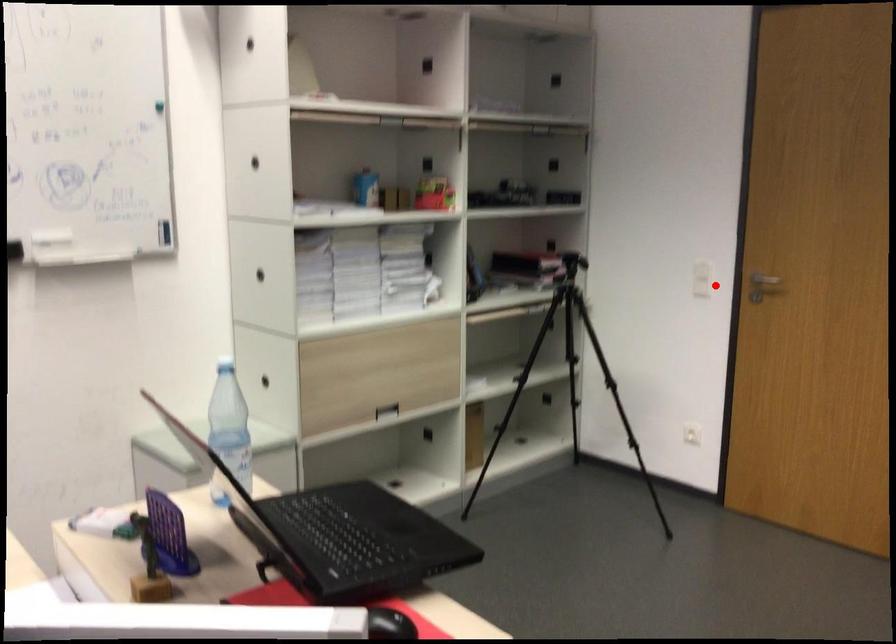
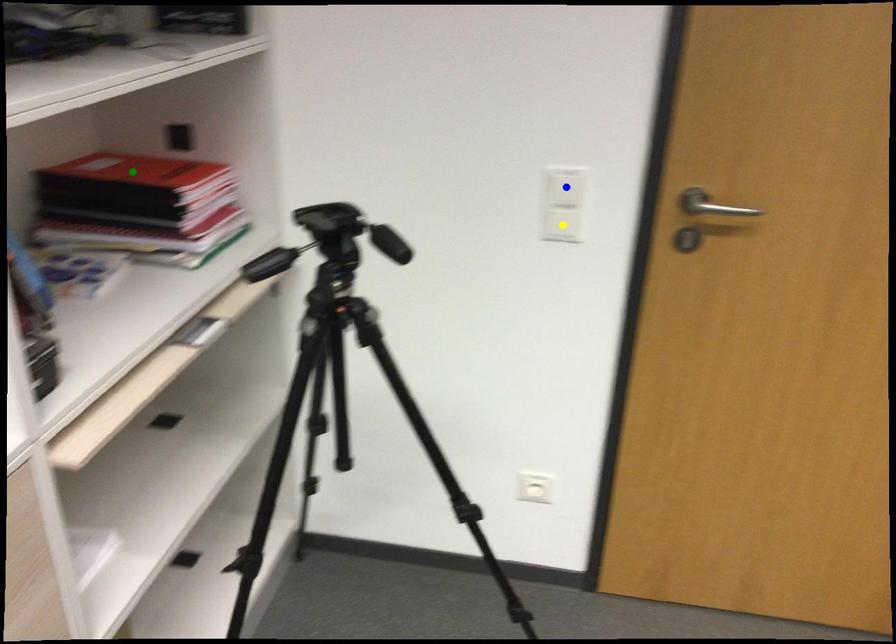
Question: I am providing you with two images of the same scene from different viewpoints. A red point is marked on the first image. You are given multiple points on the second image. Which point in image 2 is actually the same real-world point as the red point in image 1?

Choices:
 (A) green point
 (B) yellow point
 (C) blue point

Answer: (B)